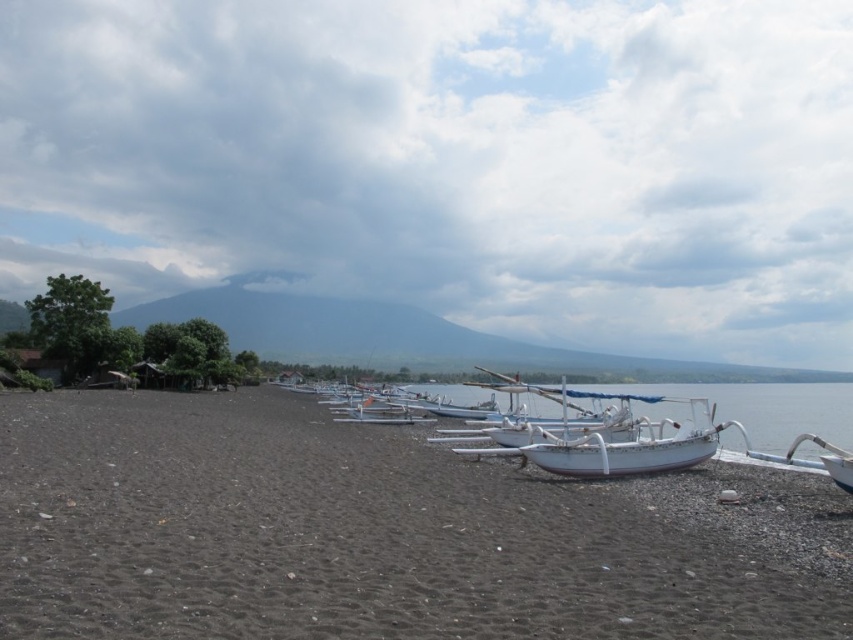
Question: Which object appears closest to the camera in this image?

Choices:
 (A) white glossy boat at center
 (B) dark brown gravel at center

Answer: (B)

Question: Which point appears closest to the camera in this image?

Choices:
 (A) (15, 481)
 (B) (550, 465)

Answer: (A)

Question: Can you confirm if dark brown gravel at center is positioned below white glossy boat at center?

Choices:
 (A) yes
 (B) no

Answer: (A)

Question: Does dark brown gravel at center appear on the right side of white glossy boat at center?

Choices:
 (A) no
 (B) yes

Answer: (A)

Question: Can you confirm if dark brown gravel at center is positioned to the left of white glossy boat at center?

Choices:
 (A) yes
 (B) no

Answer: (A)